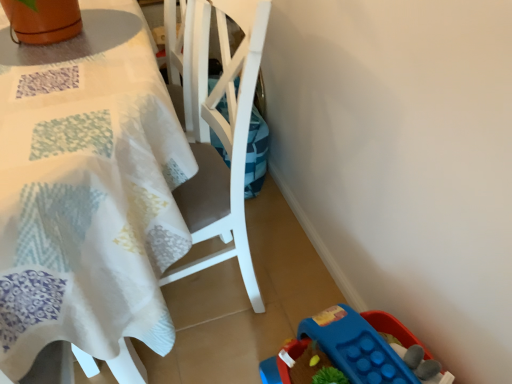
Where is `blue plastic toy at lower right`? The image size is (512, 384). blue plastic toy at lower right is located at coordinates point(353,351).

Is blue plastic toy at lower right far away from white fabric table at upper left?

No, blue plastic toy at lower right is not far from white fabric table at upper left.

Locate an element on the screen. This screenshot has width=512, height=384. toy behind the white fabric table at upper left is located at coordinates (x=353, y=351).

From the image's perspective, is blue plastic toy at lower right located above or below white fabric table at upper left?

Clearly, from the image's perspective, blue plastic toy at lower right is below white fabric table at upper left.

From the picture: Is blue plastic toy at lower right looking in the opposite direction of white fabric table at upper left?

blue plastic toy at lower right is not turned away from white fabric table at upper left.

From the image's perspective, is white plastic chair at center beneath white fabric table at upper left?

No, from the image's perspective, white plastic chair at center is not below white fabric table at upper left.

Which is correct: white plastic chair at center is inside white fabric table at upper left, or outside of it?

white plastic chair at center fits inside white fabric table at upper left.

Is white plastic chair at center wider than white fabric table at upper left?

No.

Between white fabric table at upper left and white plastic chair at center, which one has larger width?

white fabric table at upper left.

Considering the sizes of objects white fabric table at upper left and white plastic chair at center in the image provided, who is taller, white fabric table at upper left or white plastic chair at center?

Standing taller between the two is white plastic chair at center.

Is white fabric table at upper left completely or partially outside of white plastic chair at center?

white fabric table at upper left lies outside white plastic chair at center's area.

From the image's perspective, which is below, white fabric table at upper left or white plastic chair at center?

From the image's view, white fabric table at upper left is below.

From a real-world perspective, is white fabric table at upper left over blue plastic toy at lower right?

Yes, from a real-world perspective, white fabric table at upper left is over blue plastic toy at lower right

Is white fabric table at upper left located outside blue plastic toy at lower right?

white fabric table at upper left lies outside blue plastic toy at lower right's area.

In the scene shown: In the image, is white fabric table at upper left positioned in front of or behind blue plastic toy at lower right?

white fabric table at upper left is positioned closer to the viewer than blue plastic toy at lower right.

Considering the points (360, 326) and (241, 121), which point is behind, point (360, 326) or point (241, 121)?

The point (360, 326) is more distant.

Is blue plastic toy at lower right thinner than white plastic chair at center?

Indeed, blue plastic toy at lower right has a lesser width compared to white plastic chair at center.

Which object is positioned more to the left, blue plastic toy at lower right or white plastic chair at center?

white plastic chair at center is more to the left.

How many degrees apart are the facing directions of blue plastic toy at lower right and white plastic chair at center?

blue plastic toy at lower right and white plastic chair at center are facing 86.6 degrees away from each other.

Is white plastic chair at center wider than blue plastic toy at lower right?

Indeed, white plastic chair at center has a greater width compared to blue plastic toy at lower right.

From the picture: From a real-world perspective, is white plastic chair at center physically located above or below blue plastic toy at lower right?

white plastic chair at center is above blue plastic toy at lower right.

Is white plastic chair at center positioned with its back to blue plastic toy at lower right?

That's right, white plastic chair at center is facing away from blue plastic toy at lower right.

Where is `toy behind the white fabric table at upper left`? toy behind the white fabric table at upper left is located at coordinates (353, 351).

Image resolution: width=512 pixels, height=384 pixels. In order to click on table below the white plastic chair at center (from a real-world perspective) in this screenshot , I will do `click(87, 190)`.

Looking at this image, considering their positions, is blue plastic toy at lower right positioned closer to white plastic chair at center than white fabric table at upper left?

The object closer to white plastic chair at center is white fabric table at upper left.

Which object lies further to the anchor point blue plastic toy at lower right, white plastic chair at center or white fabric table at upper left?

white fabric table at upper left lies further to blue plastic toy at lower right than the other object.

From the image, which object appears to be nearer to blue plastic toy at lower right, white fabric table at upper left or white plastic chair at center?

white plastic chair at center.

Estimate the real-world distances between objects in this image. Which object is further from white fabric table at upper left, blue plastic toy at lower right or white plastic chair at center?

The object further to white fabric table at upper left is blue plastic toy at lower right.

Based on their spatial positions, is white fabric table at upper left or blue plastic toy at lower right further from white plastic chair at center?

Based on the image, blue plastic toy at lower right appears to be further to white plastic chair at center.

Which object lies further to the anchor point white fabric table at upper left, white plastic chair at center or blue plastic toy at lower right?

The object further to white fabric table at upper left is blue plastic toy at lower right.

Locate an element on the screen. The height and width of the screenshot is (384, 512). chair located between white fabric table at upper left and blue plastic toy at lower right in the left-right direction is located at coordinates (219, 130).